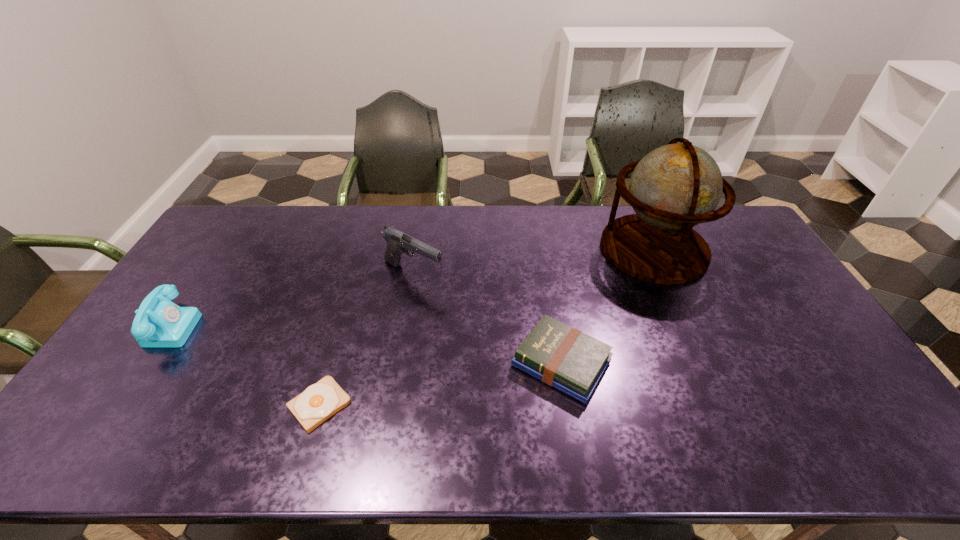
At what (x,y) coordinates should I click in order to perform the action: click on vacant point located on the dial of the third tallest object. Please return your answer as a coordinate pair (x, y). This screenshot has height=540, width=960. Looking at the image, I should click on (309, 325).

Where is `vacant space located on the right of the fourth tallest object`? vacant space located on the right of the fourth tallest object is located at coordinates 686,363.

This screenshot has height=540, width=960. Find the location of `vacant space situated 0.230m on the right of the shortest object`. vacant space situated 0.230m on the right of the shortest object is located at coordinates (443, 404).

This screenshot has height=540, width=960. I want to click on object that is positioned at the far edge, so click(675, 187).

You are a GUI agent. You are given a task and a screenshot of the screen. Output one action in this format:
    pyautogui.click(x=<x>, y=<y>)
    Task: Click on the object that is at the near edge
    The width and height of the screenshot is (960, 540).
    Given the screenshot: What is the action you would take?
    (x=320, y=401)

Locate an element on the screen. This screenshot has height=540, width=960. object that is at the left edge is located at coordinates (159, 323).

At what (x,y) coordinates should I click in order to perform the action: click on vacant space at the far edge. Please return your answer as a coordinate pair (x, y). The width and height of the screenshot is (960, 540). Looking at the image, I should click on (463, 220).

The image size is (960, 540). Identify the location of vacant space at the near edge of the desktop. (645, 430).

Find the location of a particular element. This screenshot has height=540, width=960. vacant space at the left edge of the desktop is located at coordinates (163, 373).

The image size is (960, 540). In the image, there is a desktop. Identify the location of blank space at the right edge. (791, 343).